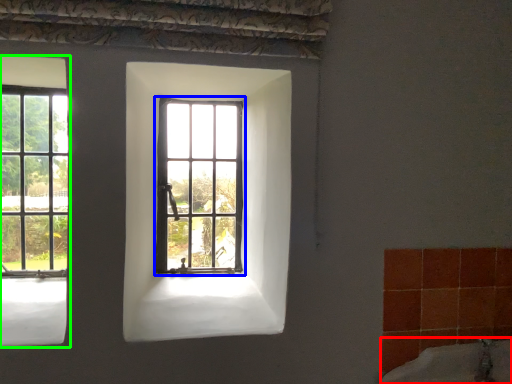
Question: Considering the real-world distances, which object is farthest from bath (highlighted by a red box)? window (highlighted by a blue box) or window (highlighted by a green box)?

Choices:
 (A) window
 (B) window

Answer: (B)